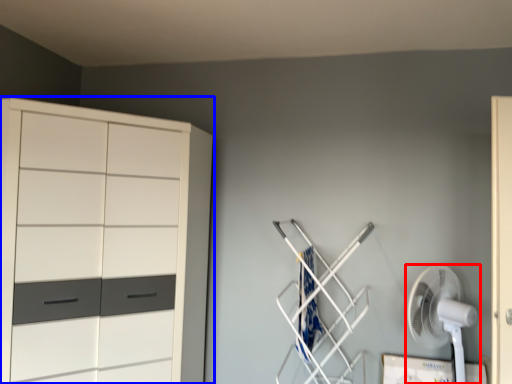
Question: Which object is further to the camera taking this photo, mechanical fan (highlighted by a red box) or cupboard (highlighted by a blue box)?

Choices:
 (A) mechanical fan
 (B) cupboard

Answer: (A)